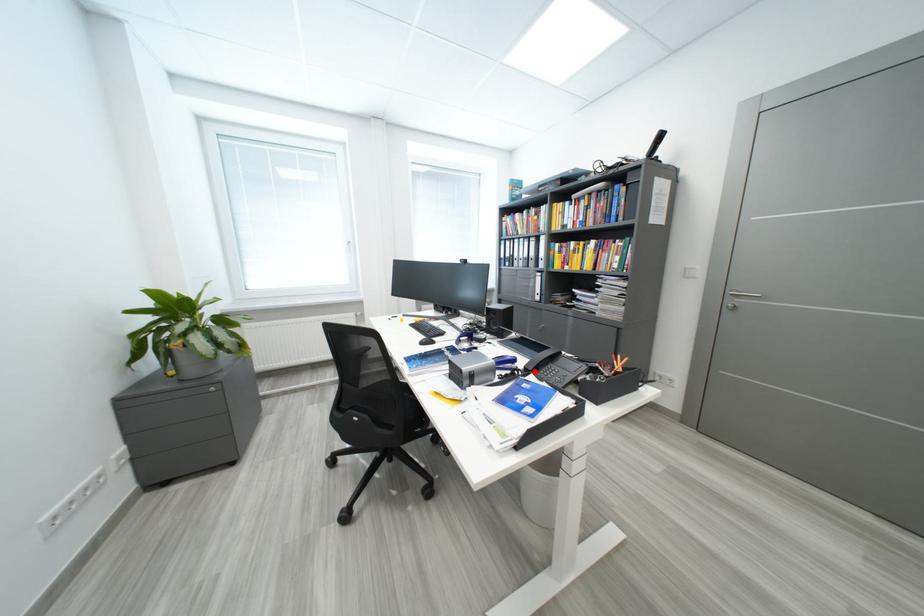
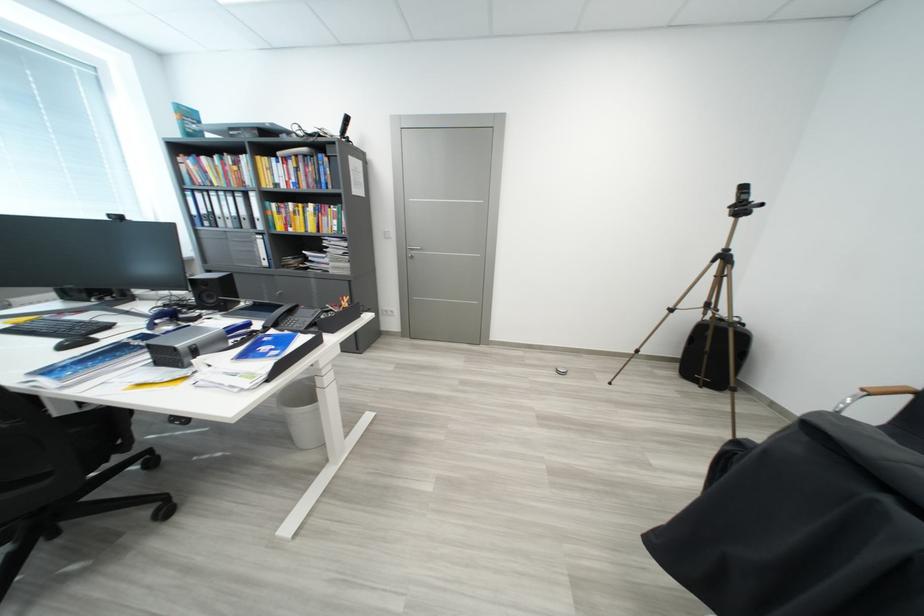
Where in the second image is the point corresponding to the highlighted location from the first image?

(274, 330)